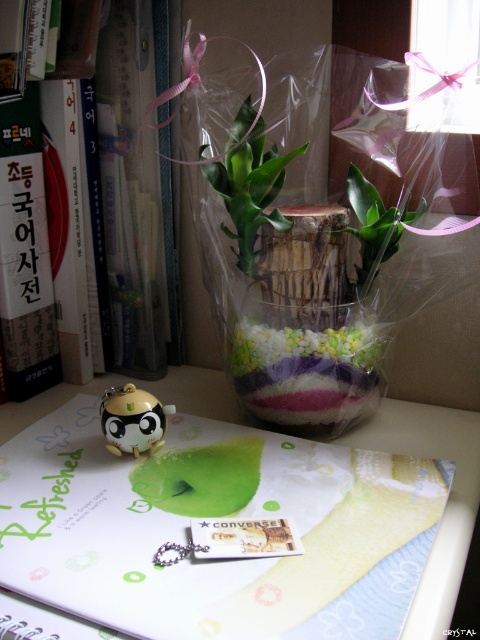
You are organizing items on a desk and have a translucent plastic vase at upper center and a matte yellow plastic panda at center. Which object is shorter?

The translucent plastic vase at upper center is shorter than the matte yellow plastic panda at center.

You are organizing items on a desk and need to place a new item between the green matte notebook at center and the hardcover book at left. Based on their positions, where should you place the new item?

The green matte notebook at center is located above the hardcover book at left, so you should place the new item between them either below the green matte notebook at center and above the hardcover book at left or adjust their positions accordingly.